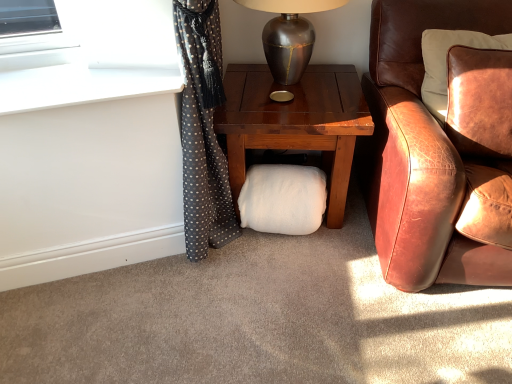
Locate an element on the screen. The image size is (512, 384). free space in front of metallic silver table lamp at upper center is located at coordinates (305, 117).